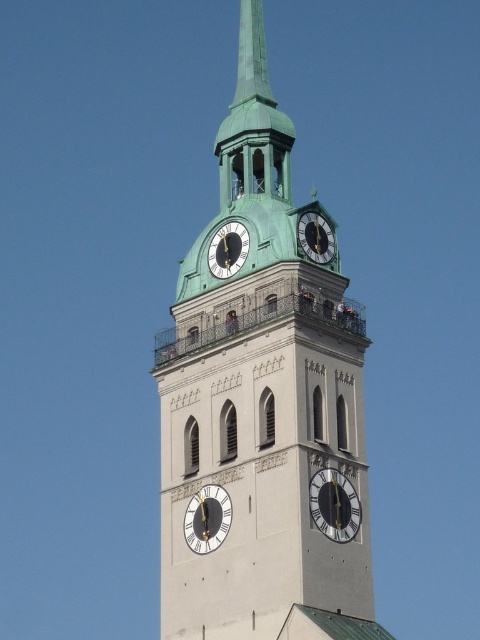
Question: Is green polished wood spire at upper center wider than green polished metal spire at upper center?

Choices:
 (A) yes
 (B) no

Answer: (A)

Question: Does silver metallic clock at center appear over matte gold clock at center?

Choices:
 (A) yes
 (B) no

Answer: (A)

Question: Which of the following is the closest to the observer?

Choices:
 (A) (195, 502)
 (B) (277, 122)

Answer: (A)

Question: Can you confirm if silver metallic clock at center is bigger than metallic gold clock at upper center?

Choices:
 (A) no
 (B) yes

Answer: (A)

Question: Which point is farther from the camera taking this photo?

Choices:
 (A) (250, 509)
 (B) (252, 76)
 (C) (254, 92)

Answer: (B)

Question: Which object is closer to the camera taking this photo?

Choices:
 (A) silver metallic clock at center
 (B) metallic gold clock at upper center

Answer: (A)